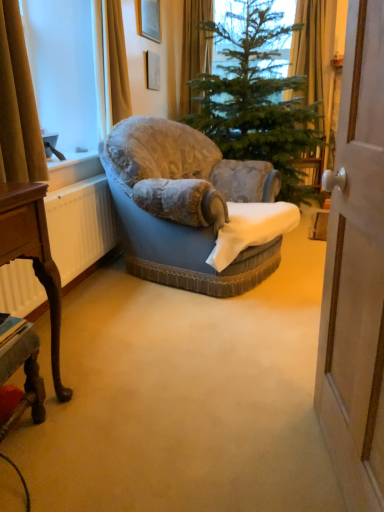
Locate an element on the screen. empty space that is to the right of wooden polished desk at lower left, acting as the 2th desk starting from the bottom is located at coordinates (101, 426).